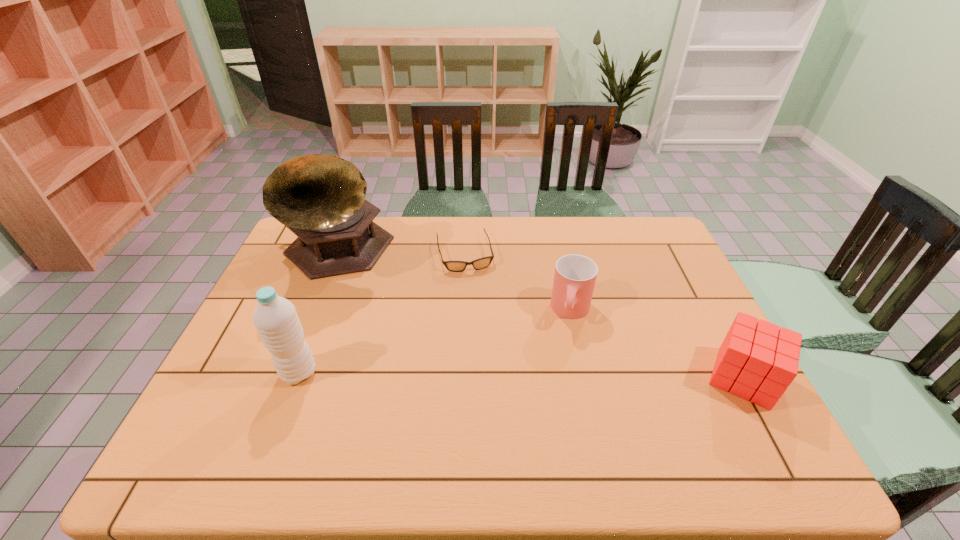
Find the location of a particular element. The height and width of the screenshot is (540, 960). free space on the desktop that is between the second tallest object and the rightmost object and is positioned on the front-facing side of the shortest object is located at coordinates (496, 375).

Where is `free space on the desktop that is between the second tallest object and the rightmost object and is positioned on the side of the cup with the handle`? free space on the desktop that is between the second tallest object and the rightmost object and is positioned on the side of the cup with the handle is located at coordinates (559, 375).

This screenshot has width=960, height=540. I want to click on vacant space on the desktop that is between the water bottle and the rightmost object and is positioned on the horn direction of the tallest object, so click(x=481, y=375).